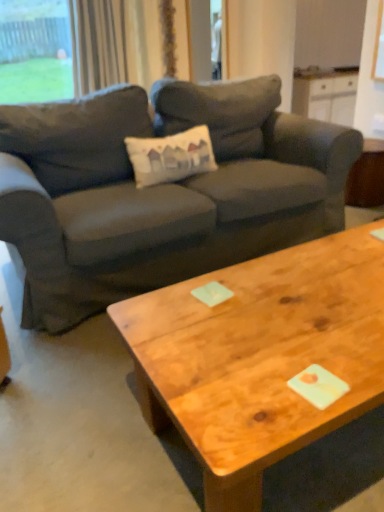
Where is `empty space that is ontop of wooden coffee table at center (from a real-world perspective)`? The height and width of the screenshot is (512, 384). empty space that is ontop of wooden coffee table at center (from a real-world perspective) is located at coordinates (292, 306).